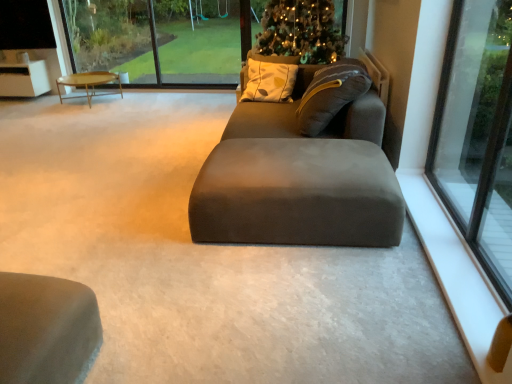
The height and width of the screenshot is (384, 512). In order to click on transparent glass window at upper center in this screenshot , I will do point(161,39).

Where is `green plastic swing set at upper center`? green plastic swing set at upper center is located at coordinates (201, 52).

Image resolution: width=512 pixels, height=384 pixels. Describe the element at coordinates (298, 178) in the screenshot. I see `suede-like gray studio couch at center` at that location.

The image size is (512, 384). Describe the element at coordinates (269, 113) in the screenshot. I see `suede gray bean bag at center` at that location.

The width and height of the screenshot is (512, 384). I want to click on suede gray bean bag at center, so click(x=269, y=113).

Image resolution: width=512 pixels, height=384 pixels. What do you see at coordinates (87, 83) in the screenshot?
I see `wooden polished coffee table at left` at bounding box center [87, 83].

Where is `transparent glass window at upper center`? transparent glass window at upper center is located at coordinates (161, 39).

Can you confirm if white smooth window sill at lower right is wider than suede gray bean bag at center?

No, white smooth window sill at lower right is not wider than suede gray bean bag at center.

Can you tell me how much white smooth window sill at lower right and suede gray bean bag at center differ in facing direction?

0.788 degrees separate the facing orientations of white smooth window sill at lower right and suede gray bean bag at center.

From a real-world perspective, is white smooth window sill at lower right beneath suede gray bean bag at center?

Yes.

Considering the relative sizes of white smooth window sill at lower right and suede gray bean bag at center in the image provided, is white smooth window sill at lower right taller than suede gray bean bag at center?

Incorrect, the height of white smooth window sill at lower right is not larger of that of suede gray bean bag at center.

Consider the image. Who is smaller, wooden polished coffee table at left or suede gray bean bag at center?

wooden polished coffee table at left.

Is wooden polished coffee table at left taller or shorter than suede gray bean bag at center?

Considering their sizes, wooden polished coffee table at left has less height than suede gray bean bag at center.

Identify the location of coffee table lying behind the suede gray bean bag at center. (87, 83).

From the image's perspective, relative to suede gray bean bag at center, is wooden polished coffee table at left above or below?

wooden polished coffee table at left is above suede gray bean bag at center.

The width and height of the screenshot is (512, 384). In order to click on window lying below the wooden polished coffee table at left (from the image's perspective) in this screenshot , I will do `click(477, 133)`.

Which of these two, wooden polished coffee table at left or transparent glass window at right, is smaller?

With smaller size is transparent glass window at right.

From a real-world perspective, is wooden polished coffee table at left below transparent glass window at right?

Correct, in the physical world, wooden polished coffee table at left is lower than transparent glass window at right.

Is wooden polished coffee table at left next to transparent glass window at right and touching it?

wooden polished coffee table at left is not next to transparent glass window at right, and they're not touching.

From a real-world perspective, who is located lower, transparent glass window at right or suede-like gray studio couch at center?

In real-world perspective, suede-like gray studio couch at center is lower.

Measure the distance from transparent glass window at right to suede-like gray studio couch at center.

A distance of 31.93 inches exists between transparent glass window at right and suede-like gray studio couch at center.

Is transparent glass window at right oriented towards suede-like gray studio couch at center?

Yes, transparent glass window at right faces towards suede-like gray studio couch at center.

Is transparent glass window at right outside of suede-like gray studio couch at center?

Absolutely, transparent glass window at right is external to suede-like gray studio couch at center.

Are suede-like gray studio couch at center and wooden polished coffee table at left located far from each other?

That's right, there is a large distance between suede-like gray studio couch at center and wooden polished coffee table at left.

Which is in front, point (198, 201) or point (82, 82)?

The point (198, 201) is closer.

Considering the sizes of suede-like gray studio couch at center and wooden polished coffee table at left in the image, is suede-like gray studio couch at center taller or shorter than wooden polished coffee table at left?

Considering their sizes, suede-like gray studio couch at center has more height than wooden polished coffee table at left.

Between white smooth window sill at lower right and transparent glass window at upper center, which one has less height?

With less height is white smooth window sill at lower right.

Can transparent glass window at upper center be found inside white smooth window sill at lower right?

No.

Is white smooth window sill at lower right in front of or behind transparent glass window at upper center in the image?

Clearly, white smooth window sill at lower right is in front of transparent glass window at upper center.

From a real-world perspective, relative to transparent glass window at upper center, is white smooth window sill at lower right vertically above or below?

white smooth window sill at lower right is situated lower than transparent glass window at upper center in the real world.

Between suede-like gray studio couch at center and transparent glass window at right, which one has less height?

suede-like gray studio couch at center is shorter.

Do you think suede-like gray studio couch at center is within transparent glass window at right, or outside of it?

suede-like gray studio couch at center lies outside transparent glass window at right.

Is the depth of suede-like gray studio couch at center less than that of transparent glass window at right?

No, suede-like gray studio couch at center is further to the viewer.

Who is smaller, suede-like gray studio couch at center or transparent glass window at right?

With smaller size is transparent glass window at right.

Identify the location of bean bag chair lying on the left of white smooth window sill at lower right. This screenshot has width=512, height=384. (269, 113).

Where is `bean bag chair on the right of wooden polished coffee table at left`? Image resolution: width=512 pixels, height=384 pixels. bean bag chair on the right of wooden polished coffee table at left is located at coordinates (269, 113).

Considering their positions, is transparent glass window at right positioned closer to suede-like gray studio couch at center than wooden polished coffee table at left?

Among the two, transparent glass window at right is located nearer to suede-like gray studio couch at center.

When comparing their distances from white smooth window sill at lower right, does wooden polished coffee table at left or transparent glass window at right seem closer?

The object closer to white smooth window sill at lower right is transparent glass window at right.

Looking at the image, which one is located further to wooden polished coffee table at left, suede gray bean bag at center or transparent glass window at right?

transparent glass window at right.

Looking at the image, which one is located closer to transparent glass window at upper center, green plastic swing set at upper center or white smooth window sill at lower right?

green plastic swing set at upper center is positioned closer to the anchor transparent glass window at upper center.

When comparing their distances from transparent glass window at right, does wooden polished coffee table at left or transparent glass window at upper center seem further?

Among the two, wooden polished coffee table at left is located further to transparent glass window at right.

Looking at the image, which one is located closer to white smooth window sill at lower right, green plastic swing set at upper center or transparent glass window at upper center?

The object closer to white smooth window sill at lower right is green plastic swing set at upper center.

From the image, which object appears to be farther from transparent glass window at right, transparent glass window at upper center or wooden polished coffee table at left?

wooden polished coffee table at left is further to transparent glass window at right.

Looking at this image, based on their spatial positions, is suede gray bean bag at center or transparent glass window at right further from white smooth window sill at lower right?

Based on the image, suede gray bean bag at center appears to be further to white smooth window sill at lower right.

This screenshot has height=384, width=512. Identify the location of coffee table between suede-like gray studio couch at center and transparent glass window at upper center from front to back. [x=87, y=83].

Locate an element on the screen. The image size is (512, 384). glass window between suede-like gray studio couch at center and green plastic swing set at upper center in the front-back direction is located at coordinates (161, 39).

Locate an element on the screen. Image resolution: width=512 pixels, height=384 pixels. bean bag chair between white smooth window sill at lower right and transparent glass window at upper center in the front-back direction is located at coordinates (269, 113).

Where is `studio couch positioned between white smooth window sill at lower right and transparent glass window at upper center from near to far`? The width and height of the screenshot is (512, 384). studio couch positioned between white smooth window sill at lower right and transparent glass window at upper center from near to far is located at coordinates (298, 178).